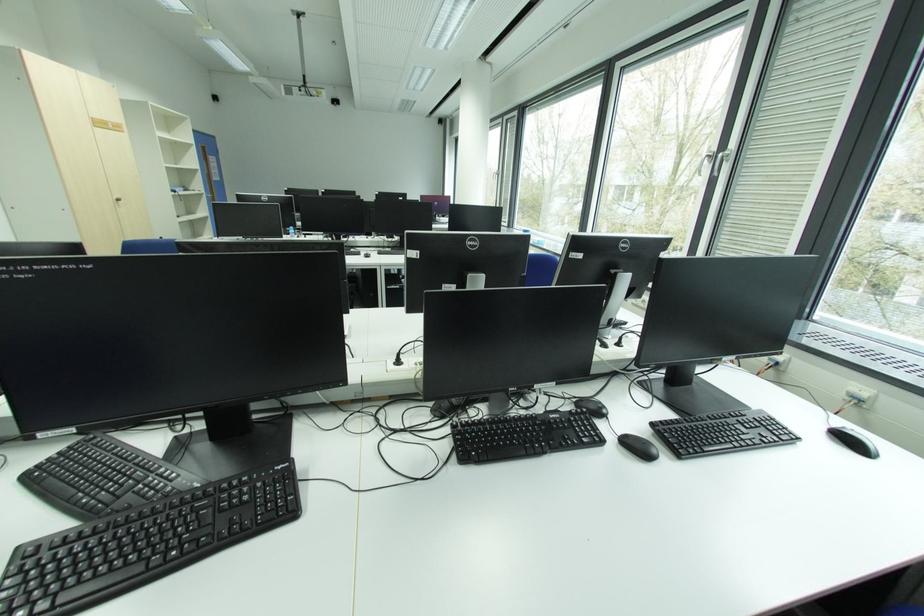
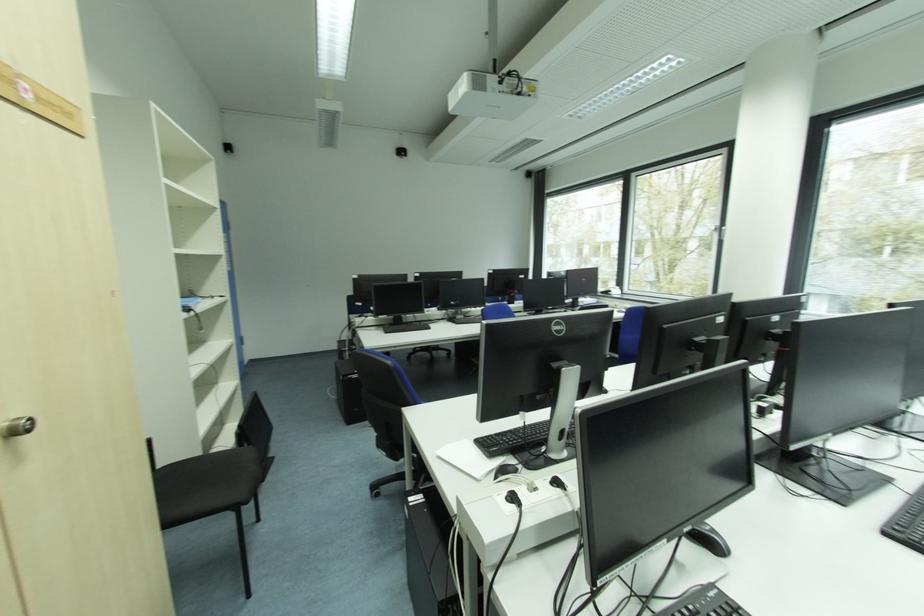
What movement of the cameraman would produce the second image?

The movement direction of the cameraman is left, forward.